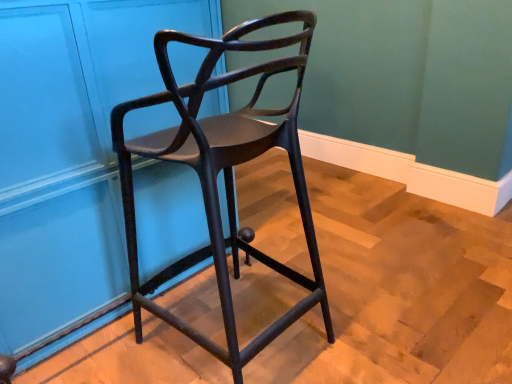
Where is `free region under matte black chair at center (from a real-world perspective)`? This screenshot has height=384, width=512. free region under matte black chair at center (from a real-world perspective) is located at coordinates (242, 316).